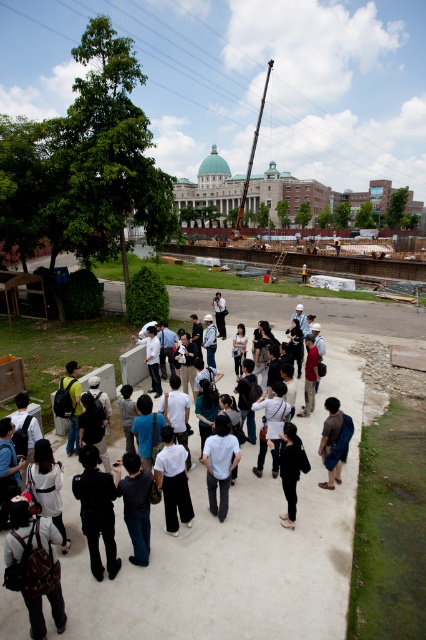
You are a photographer trying to capture a group photo of the white matte shirt at center and the brown fabric shirt at center. The camera frame can only accommodate one of them. Which one should you focus on to ensure it fits within the frame?

The white matte shirt at center might be wider than brown fabric shirt at center, so focusing on the white matte shirt at center would be better to ensure it fits within the camera frame.

You are a photographer trying to capture a group photo of the white casual clothing at center and the white matte shirt at center. Since both are white, you want to ensure they are distinguishable in the photo. Which one should you position to the left to separate them effectively?

To distinguish the white casual clothing at center and the white matte shirt at center, position the white matte shirt at center on the left since the white casual clothing at center is already on its right side.

You are a photographer standing at the edge of the construction site. You want to capture both the white matte shirt at center and the brown fabric shirt at center in a single frame. The camera you are using has a focal length that can cover a maximum distance of 12 feet between subjects. Will you be able to include both shirts in the photo?

The distance between the white matte shirt at center and brown fabric shirt at center is 12.01 feet, which exceeds the camera maximum coverage of 12 feet. Therefore, you cannot include both shirts in the photo.